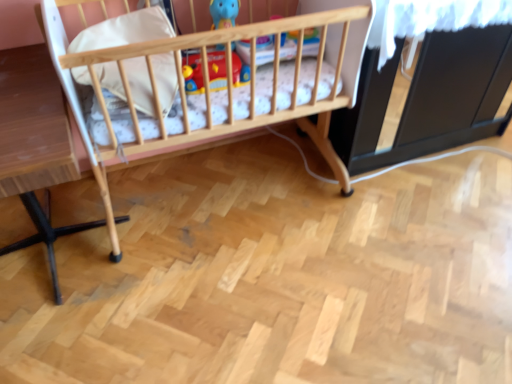
This screenshot has height=384, width=512. In order to click on vacant space in wooden crib at center (from a real-world perspective) in this screenshot , I will do `click(211, 186)`.